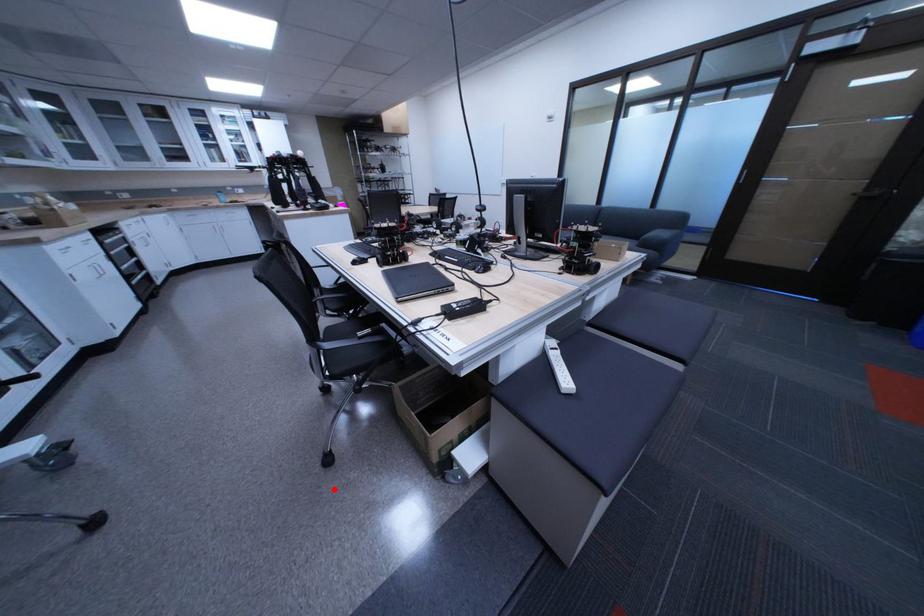
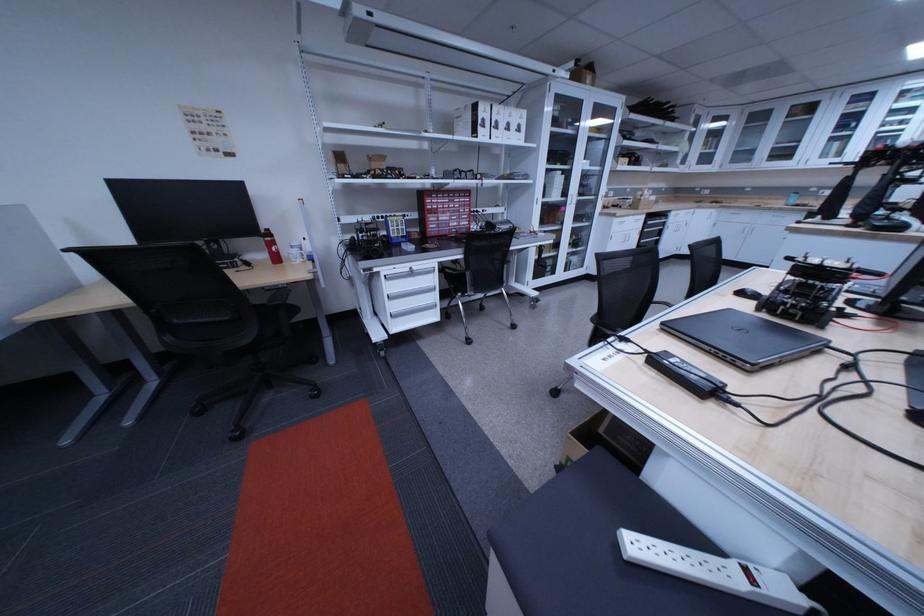
The point at the highlighted location is marked in the first image. Where is the corresponding point in the second image?

(553, 395)